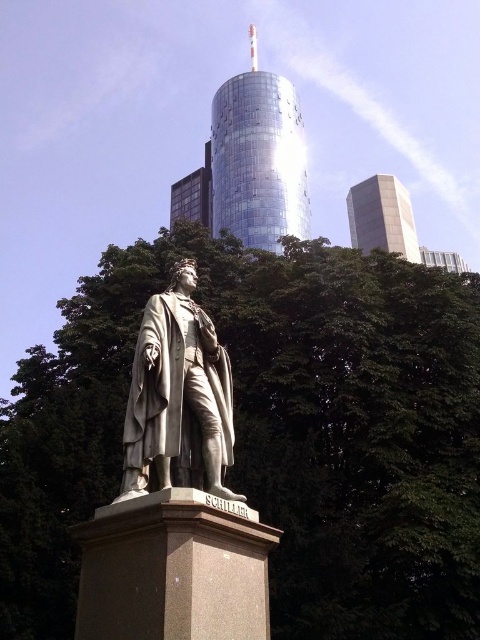
Question: Which object appears closest to the camera in this image?

Choices:
 (A) green leafy tree at center
 (B) gray stone statue at center

Answer: (B)

Question: Which object is positioned farthest from the gray stone statue at center?

Choices:
 (A) green leafy tree at center
 (B) shiny glass tower at upper center
 (C) white glass tower at upper right

Answer: (C)

Question: Is green leafy tree at center thinner than shiny glass tower at upper center?

Choices:
 (A) yes
 (B) no

Answer: (B)

Question: Is gray stone statue at center to the left of white glass tower at upper right from the viewer's perspective?

Choices:
 (A) no
 (B) yes

Answer: (B)

Question: Which object is positioned farthest from the white glass tower at upper right?

Choices:
 (A) green leafy tree at center
 (B) gray stone statue at center
 (C) shiny glass tower at upper center

Answer: (B)

Question: Is gray stone statue at center positioned before white glass tower at upper right?

Choices:
 (A) no
 (B) yes

Answer: (B)